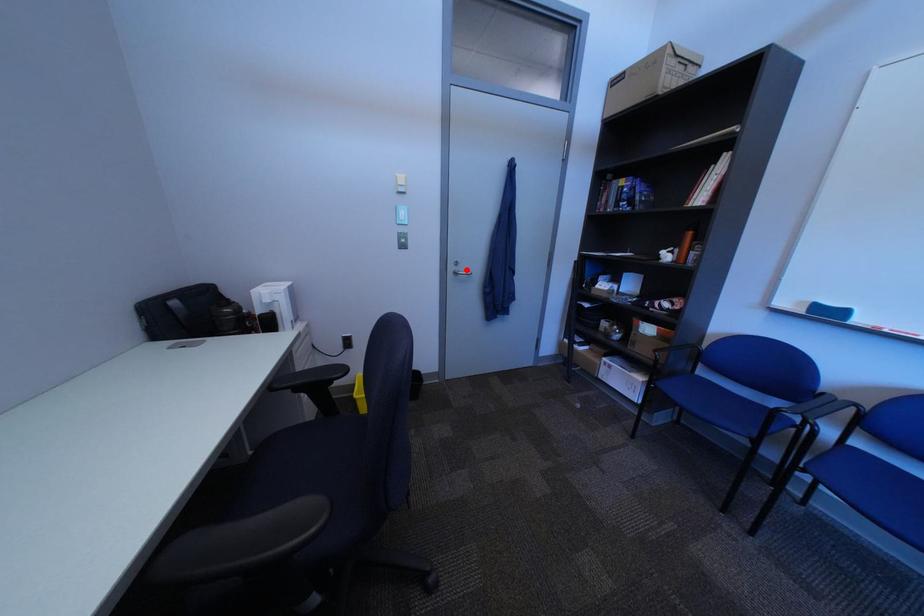
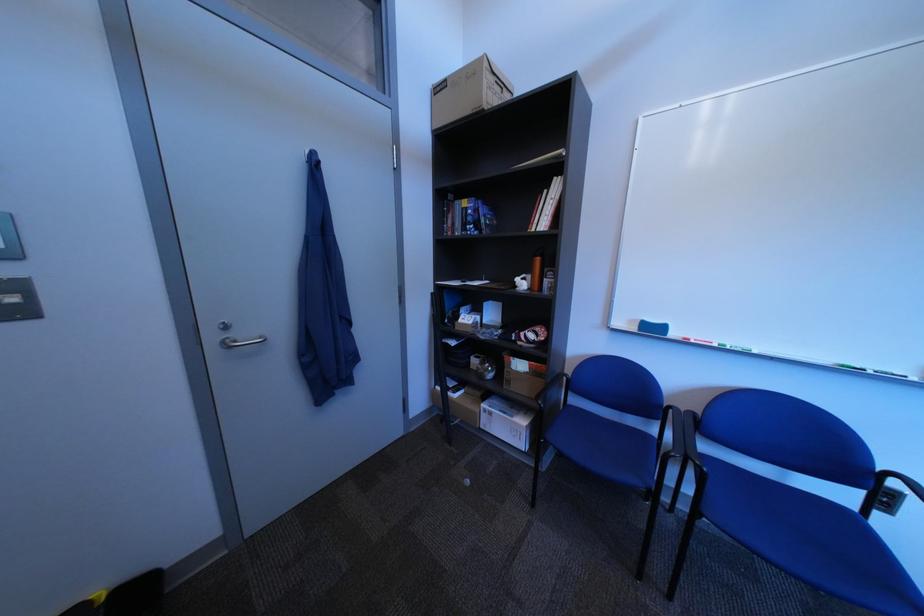
Find the pixel in the second image that matches the highlighted location in the first image.

(226, 339)